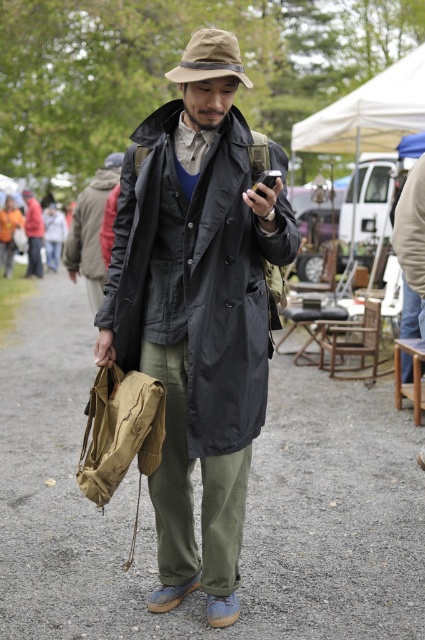
Question: Can you confirm if white fabric canopy at upper center is bigger than matte khaki bag at left?

Choices:
 (A) yes
 (B) no

Answer: (A)

Question: Among these points, which one is nearest to the camera?

Choices:
 (A) (107, 168)
 (B) (229, 36)

Answer: (B)

Question: Is khaki fabric fedora at center positioned at the back of brown fabric hat at center?

Choices:
 (A) yes
 (B) no

Answer: (B)

Question: Which point is closer to the camera?

Choices:
 (A) khaki cotton jacket at center
 (B) matte khaki bag at left
 (C) khaki fabric fedora at center
 (D) brown fabric hat at center

Answer: (C)

Question: Which object is positioned closest to the khaki cotton jacket at center?

Choices:
 (A) white fabric canopy at upper center
 (B) khaki fabric fedora at center

Answer: (B)

Question: Is khaki canvas duffel at lower left further to the viewer compared to matte khaki bag at left?

Choices:
 (A) yes
 (B) no

Answer: (B)